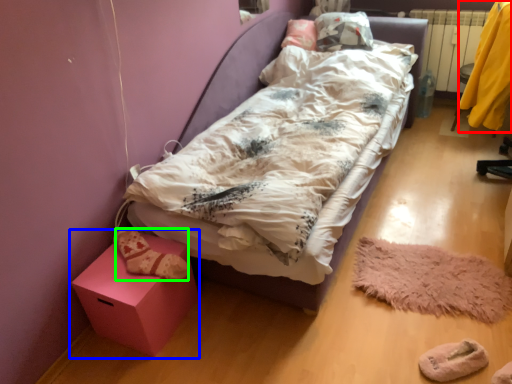
Question: Which object is the farthest from clothing (highlighted by a red box)? Choose among these: furniture (highlighted by a blue box) or shoe (highlighted by a green box).

Choices:
 (A) furniture
 (B) shoe

Answer: (A)